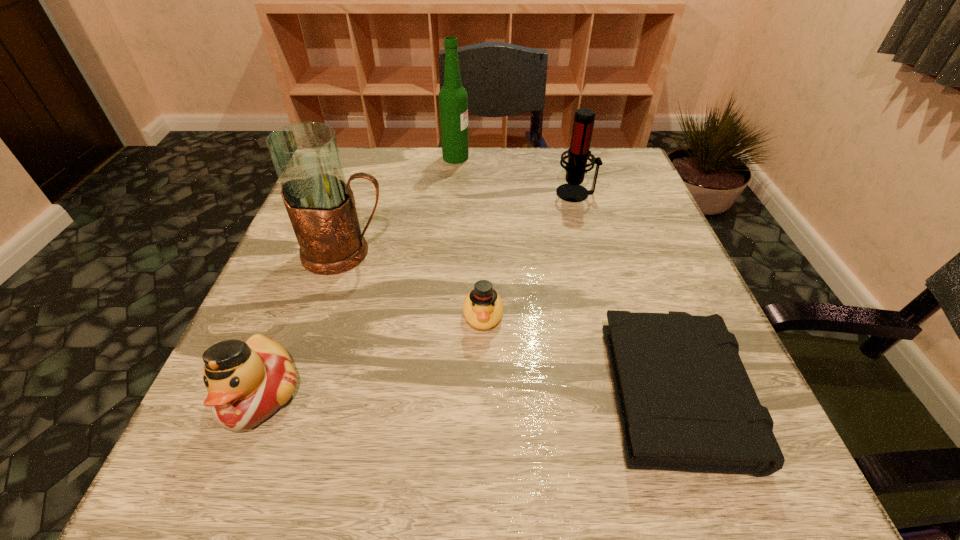
Locate an element on the screen. The height and width of the screenshot is (540, 960). free spot between the microphone and the farthest object is located at coordinates (516, 175).

Locate which object is the third closest to the third shortest object. Please provide its 2D coordinates. Your answer should be formatted as a tuple, i.e. [(x, y)], where the tuple contains the x and y coordinates of a point satisfying the conditions above.

[(685, 401)]

Find the location of a particular element. The image size is (960, 540). object that is the closest one to the beer bottle is located at coordinates (578, 153).

Where is `vacant area that satisfies the following two spatial constraints: 1. on the front-facing side of the shortest object; 2. on the left side of the second shortest object`? The height and width of the screenshot is (540, 960). vacant area that satisfies the following two spatial constraints: 1. on the front-facing side of the shortest object; 2. on the left side of the second shortest object is located at coordinates (484, 387).

Where is `vacant area that satisfies the following two spatial constraints: 1. on the back side of the third tallest object; 2. on the label of the beer bottle`? vacant area that satisfies the following two spatial constraints: 1. on the back side of the third tallest object; 2. on the label of the beer bottle is located at coordinates (565, 157).

The image size is (960, 540). Identify the location of vacant point that satisfies the following two spatial constraints: 1. on the front side of the shortest object; 2. on the left side of the fifth nearest object. (630, 387).

Locate an element on the screen. The width and height of the screenshot is (960, 540). vacant space that satisfies the following two spatial constraints: 1. with the handle on the side of the third farthest object; 2. on the face of the nearer duck is located at coordinates (299, 395).

Where is `blank space that satisfies the following two spatial constraints: 1. on the label of the farthest object; 2. on the back side of the second farthest object`? The width and height of the screenshot is (960, 540). blank space that satisfies the following two spatial constraints: 1. on the label of the farthest object; 2. on the back side of the second farthest object is located at coordinates (453, 193).